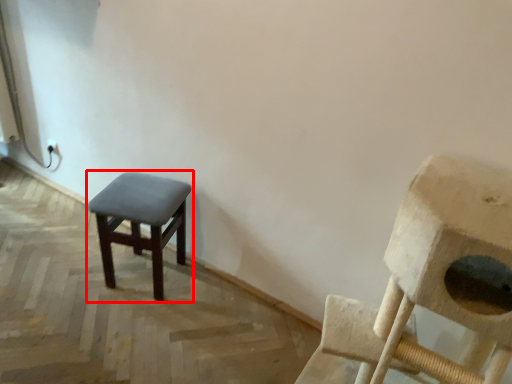
Question: Observing the image, what is the correct spatial positioning of stool (annotated by the red box) in reference to chair?

Choices:
 (A) left
 (B) right

Answer: (A)